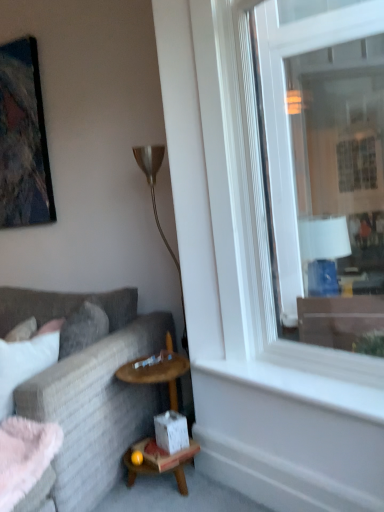
Describe the element at coordinates (300, 387) in the screenshot. The width and height of the screenshot is (384, 512). I see `white smooth window sill at lower right` at that location.

This screenshot has height=512, width=384. In order to click on textured gray couch at left in this screenshot , I will do `click(90, 389)`.

What are the coordinates of `metallic gold floor lamp at center` in the screenshot? It's located at (155, 205).

The height and width of the screenshot is (512, 384). What are the coordinates of `white smooth window sill at lower right` in the screenshot? It's located at (300, 387).

Does textured gray couch at left have a greater width compared to white smooth window sill at lower right?

Yes, textured gray couch at left is wider than white smooth window sill at lower right.

Identify the location of window sill on the right of textured gray couch at left. The image size is (384, 512). (300, 387).

Considering the relative positions of textured gray couch at left and white smooth window sill at lower right in the image provided, is textured gray couch at left to the left of white smooth window sill at lower right from the viewer's perspective?

Correct, you'll find textured gray couch at left to the left of white smooth window sill at lower right.

Is textured gray couch at left bigger than white smooth window sill at lower right?

Yes.

Which is less distant, [153,161] or [260,205]?

The point [260,205] is more forward.

From the image's perspective, relative to clear glass window at right, is metallic gold floor lamp at center above or below?

Based on their image positions, metallic gold floor lamp at center is located beneath clear glass window at right.

Between metallic gold floor lamp at center and clear glass window at right, which one has more height?

clear glass window at right is taller.

In the scene shown: Is matte black picture frame at upper left taller than metallic gold floor lamp at center?

No.

Is matte black picture frame at upper left not inside metallic gold floor lamp at center?

That's correct, matte black picture frame at upper left is outside of metallic gold floor lamp at center.

Could you tell me if matte black picture frame at upper left is facing metallic gold floor lamp at center?

No, matte black picture frame at upper left is not aimed at metallic gold floor lamp at center.

From the image's perspective, which object appears higher, matte black picture frame at upper left or metallic gold floor lamp at center?

matte black picture frame at upper left appears higher in the image.

Based on the photo, between textured gray couch at left and matte black picture frame at upper left, which one has more height?

matte black picture frame at upper left.

From the picture: Is textured gray couch at left inside or outside of matte black picture frame at upper left?

textured gray couch at left is located beyond the bounds of matte black picture frame at upper left.

What's the angular difference between textured gray couch at left and matte black picture frame at upper left's facing directions?

0.971 degrees.

Is textured gray couch at left next to matte black picture frame at upper left and touching it?

No, textured gray couch at left is not touching matte black picture frame at upper left.

Are clear glass window at right and white smooth window sill at lower right far apart?

Yes.

From the image's perspective, which is above, clear glass window at right or white smooth window sill at lower right?

clear glass window at right.

Between clear glass window at right and white smooth window sill at lower right, which one has larger size?

With larger size is clear glass window at right.

From a real-world perspective, does matte black picture frame at upper left stand above textured gray couch at left?

Yes, from a real-world perspective, matte black picture frame at upper left is above textured gray couch at left.

Who is taller, matte black picture frame at upper left or textured gray couch at left?

Standing taller between the two is matte black picture frame at upper left.

Visually, is matte black picture frame at upper left positioned to the left or to the right of textured gray couch at left?

matte black picture frame at upper left is positioned on textured gray couch at left's left side.

From the image's perspective, is matte black picture frame at upper left located above or below textured gray couch at left?

matte black picture frame at upper left is situated higher than textured gray couch at left in the image.

Could you tell me if metallic gold floor lamp at center is turned towards matte black picture frame at upper left?

No, metallic gold floor lamp at center is not oriented towards matte black picture frame at upper left.

What's the angular difference between metallic gold floor lamp at center and matte black picture frame at upper left's facing directions?

The facing directions of metallic gold floor lamp at center and matte black picture frame at upper left are 0.698 degrees apart.

Is metallic gold floor lamp at center not within matte black picture frame at upper left?

Yes, metallic gold floor lamp at center is not within matte black picture frame at upper left.

Between metallic gold floor lamp at center and matte black picture frame at upper left, which one appears on the left side from the viewer's perspective?

matte black picture frame at upper left.

What are the coordinates of `studio couch below the white smooth window sill at lower right (from the image's perspective)` in the screenshot? It's located at (90, 389).

In order to click on window in front of the metallic gold floor lamp at center in this screenshot , I will do `click(297, 194)`.

Based on their spatial positions, is white smooth window sill at lower right or textured gray couch at left closer to metallic gold floor lamp at center?

Based on the image, textured gray couch at left appears to be nearer to metallic gold floor lamp at center.

Which object lies further to the anchor point clear glass window at right, white smooth window sill at lower right or textured gray couch at left?

textured gray couch at left is further to clear glass window at right.

Estimate the real-world distances between objects in this image. Which object is closer to textured gray couch at left, clear glass window at right or metallic gold floor lamp at center?

metallic gold floor lamp at center lies closer to textured gray couch at left than the other object.

Considering their positions, is matte black picture frame at upper left positioned further to textured gray couch at left than clear glass window at right?

Among the two, clear glass window at right is located further to textured gray couch at left.

From the image, which object appears to be farther from metallic gold floor lamp at center, white smooth window sill at lower right or matte black picture frame at upper left?

matte black picture frame at upper left is positioned further to the anchor metallic gold floor lamp at center.

Considering their positions, is clear glass window at right positioned closer to white smooth window sill at lower right than metallic gold floor lamp at center?

Among the two, metallic gold floor lamp at center is located nearer to white smooth window sill at lower right.

Based on the photo, from the image, which object appears to be farther from white smooth window sill at lower right, metallic gold floor lamp at center or clear glass window at right?

clear glass window at right.

From the image, which object appears to be farther from white smooth window sill at lower right, clear glass window at right or textured gray couch at left?

clear glass window at right.

At what (x,y) coordinates should I click in order to perform the action: click on window between white smooth window sill at lower right and metallic gold floor lamp at center in the front-back direction. Please return your answer as a coordinate pair (x, y). Looking at the image, I should click on (297, 194).

Identify the location of lamp between matte black picture frame at upper left and white smooth window sill at lower right. (155, 205).

Identify the location of window sill between matte black picture frame at upper left and clear glass window at right. The width and height of the screenshot is (384, 512). (300, 387).

Locate an element on the screen. This screenshot has width=384, height=512. window sill between textured gray couch at left and clear glass window at right in the horizontal direction is located at coordinates (300, 387).